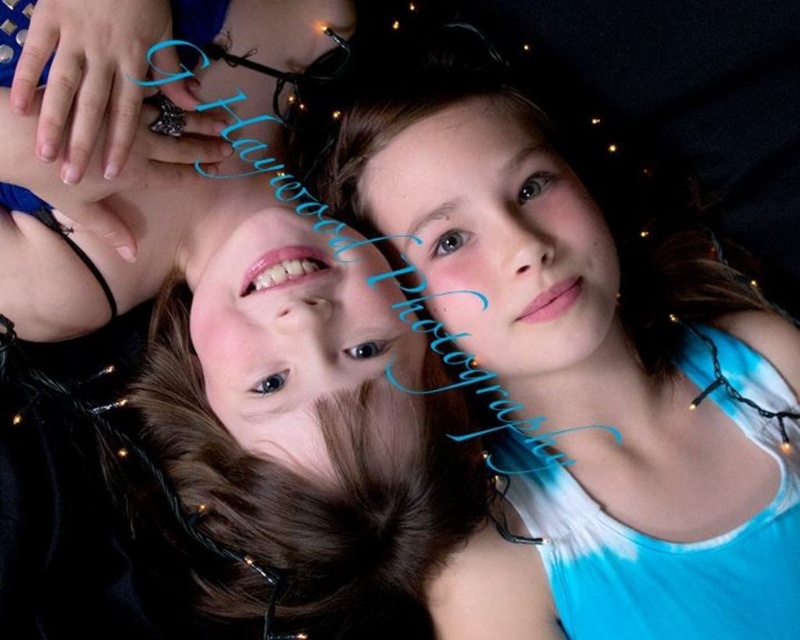
You are standing in front of the image and want to determine which of the two points, point (258,301) or point (488,113), is nearer to you. Based on the scene description, which point is closer?

Point (258,301) is closer to the viewer than point (488,113).